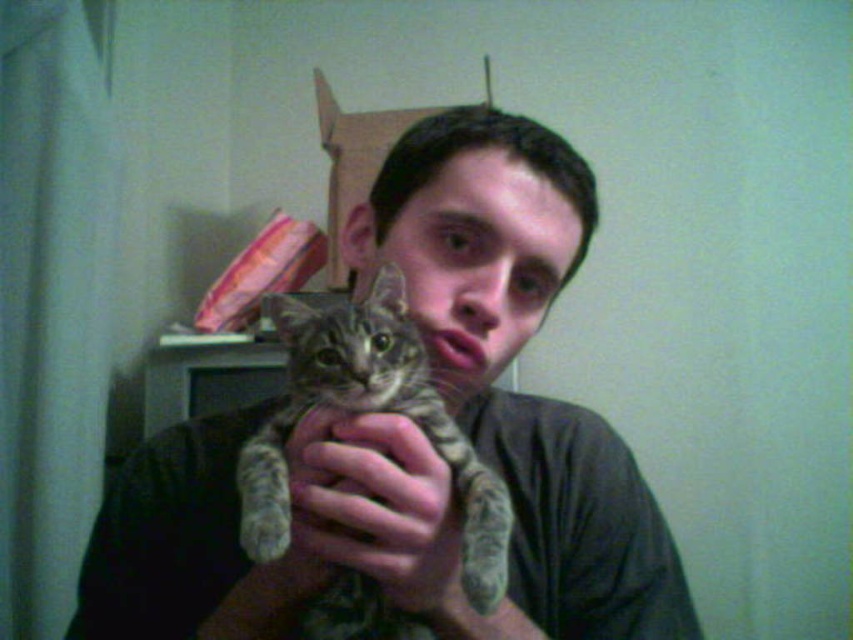
Can you confirm if tabby fur cat at center is positioned to the right of soft fur paw at center?

Incorrect, tabby fur cat at center is not on the right side of soft fur paw at center.

Who is taller, tabby fur cat at center or soft fur paw at center?

tabby fur cat at center is taller.

Between point (322, 380) and point (325, 497), which one is positioned behind?

The point (322, 380) is behind.

This screenshot has height=640, width=853. What are the coordinates of `tabby fur cat at center` in the screenshot? It's located at (368, 412).

Between smooth gray shirt at center and tabby fur cat at center, which one appears on the right side from the viewer's perspective?

smooth gray shirt at center is more to the right.

Between point (206, 596) and point (338, 392), which one is positioned in front?

Point (338, 392) is in front.

I want to click on smooth gray shirt at center, so click(x=415, y=436).

Can you confirm if smooth gray shirt at center is smaller than soft fur paw at center?

No.

Between smooth gray shirt at center and soft fur paw at center, which one appears on the right side from the viewer's perspective?

From the viewer's perspective, smooth gray shirt at center appears more on the right side.

Is point (125, 634) farther from viewer compared to point (315, 545)?

That is True.

Locate an element on the screen. The width and height of the screenshot is (853, 640). smooth gray shirt at center is located at coordinates (415, 436).